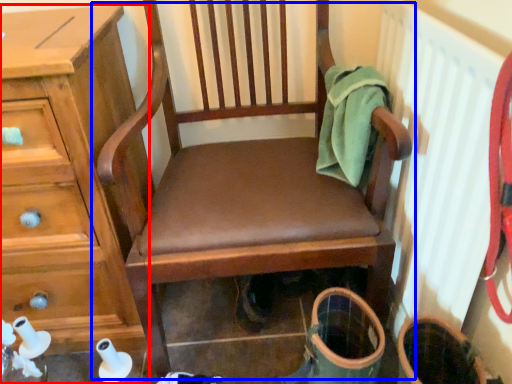
Question: Which object appears closest to the camera in this image, chest of drawers (highlighted by a red box) or chair (highlighted by a blue box)?

Choices:
 (A) chest of drawers
 (B) chair

Answer: (B)